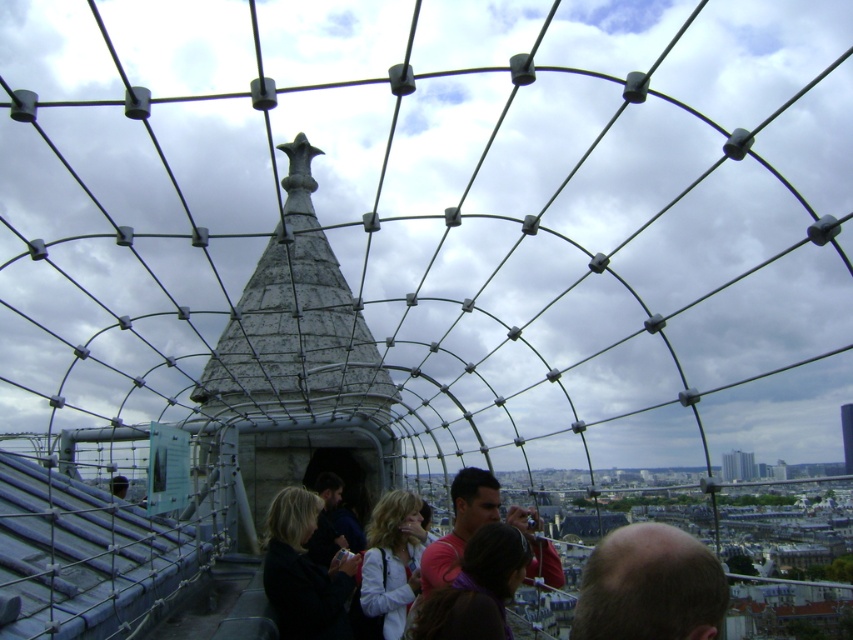
You are a photographer trying to capture a group photo of the bald head at center and the blonde hair at center. Which subject should you frame first if you want to ensure both are fully visible in the photo?

The bald head at center has a greater width than the blonde hair at center, so you should frame the bald head at center first to ensure there is enough space for the wider subject.

You are standing on the rooftop and want to take a photo of both the bald head at center and the dark gray jacket at center. Which object should you focus on first to ensure both are in the frame?

You should focus on the bald head at center first since it is closer to the viewer than the dark gray jacket at center, ensuring both are in the frame.